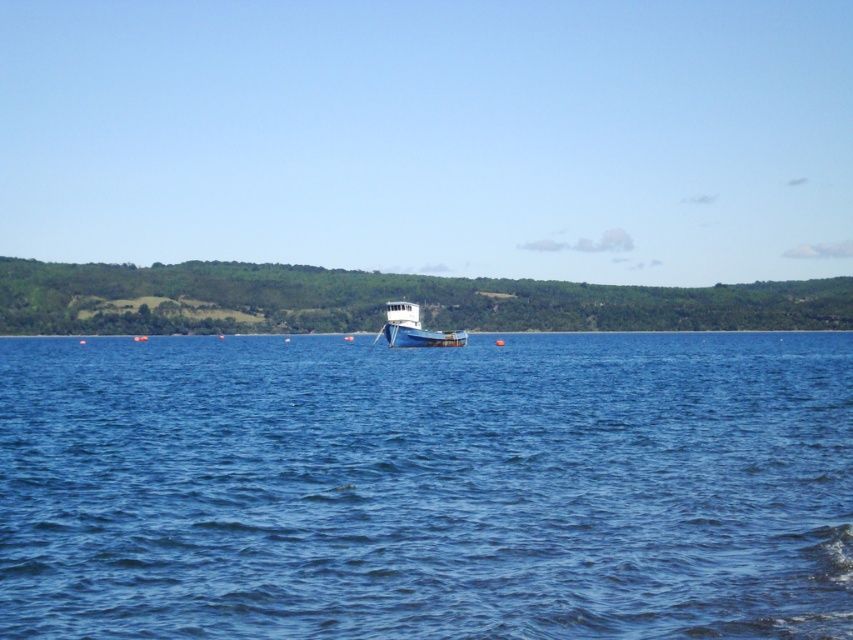
Question: From the image, what is the correct spatial relationship of blue water at center in relation to blue wooden boat at center?

Choices:
 (A) right
 (B) left

Answer: (A)

Question: Which object is closer to the camera taking this photo?

Choices:
 (A) blue wooden boat at center
 (B) blue water at center

Answer: (B)

Question: Is blue water at center positioned before blue wooden boat at center?

Choices:
 (A) yes
 (B) no

Answer: (A)

Question: Does blue water at center appear under blue wooden boat at center?

Choices:
 (A) no
 (B) yes

Answer: (B)